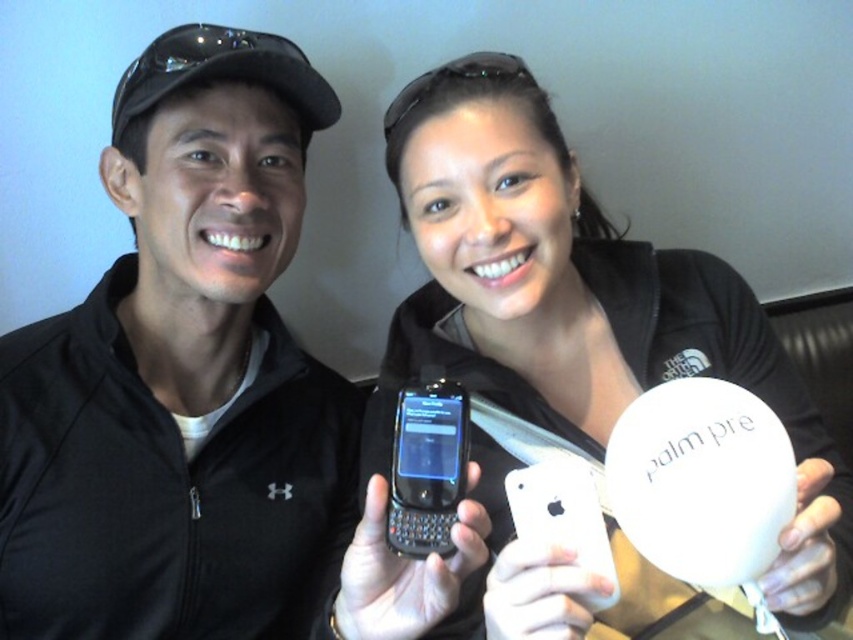
You are organizing a photo shoot and need to ensure that two items, the black matte phone at center and the white matte palm pre case at center, are positioned exactly 25 centimeters apart for proper lighting. Based on the current setup shown in the image, do you need to adjust their positions?

The black matte phone at center is currently 24.15 centimeters from the white matte palm pre case at center. Since the required distance is 25 centimeters, you need to move them slightly farther apart to meet the requirement.